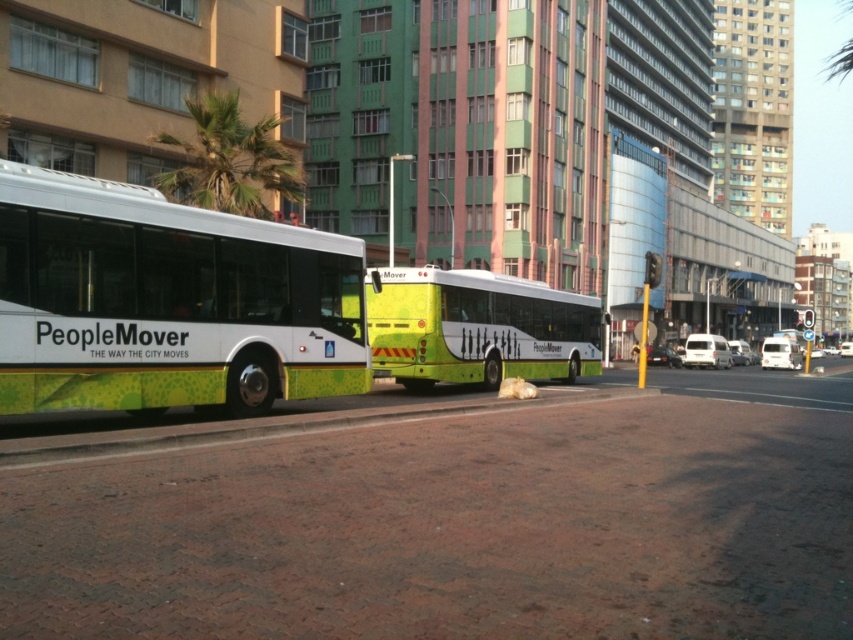
Question: Which of the following is the closest to the observer?

Choices:
 (A) [171, 369]
 (B) [524, 307]
 (C) [631, 323]

Answer: (A)

Question: Is green matte bus at center to the left of yellow-green plastic bus stop at center from the viewer's perspective?

Choices:
 (A) yes
 (B) no

Answer: (A)

Question: Which of the following is the farthest from the observer?

Choices:
 (A) green leafy palm tree at upper center
 (B) green matte bus at center
 (C) white glossy peoplemover bus at left

Answer: (A)

Question: Can you confirm if green leafy palm tree at upper center is positioned to the right of yellow-green plastic bus stop at center?

Choices:
 (A) yes
 (B) no

Answer: (B)

Question: Is green matte bus at center smaller than green leafy palm tree at upper center?

Choices:
 (A) no
 (B) yes

Answer: (A)

Question: Which is nearer to the green matte bus at center?

Choices:
 (A) green leafy palm tree at upper center
 (B) white glossy peoplemover bus at left

Answer: (A)